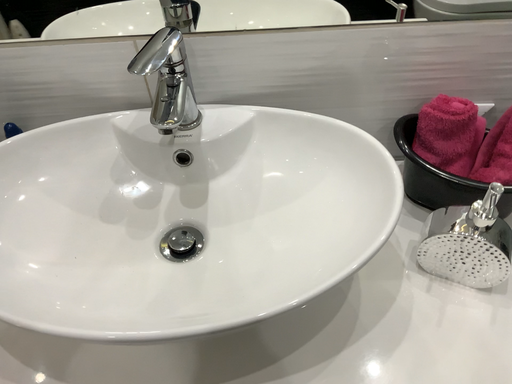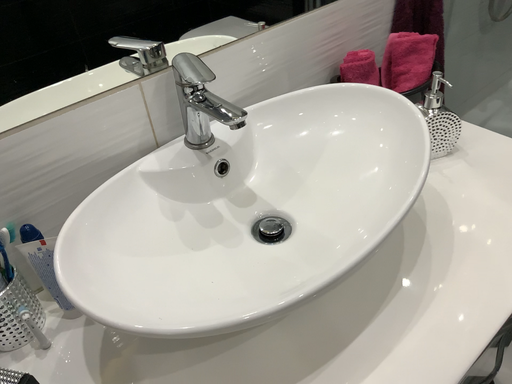
Question: Which way did the camera rotate in the video?

Choices:
 (A) rotated left
 (B) rotated right

Answer: (B)